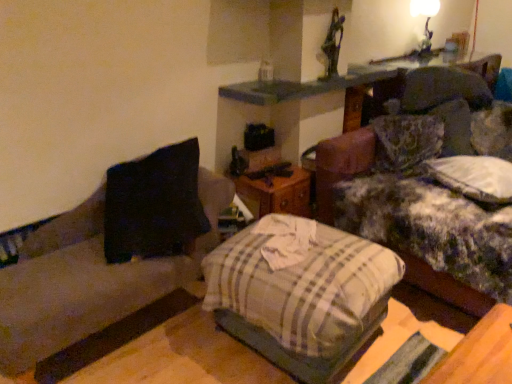
Question: Does black fabric couch at left have a smaller size compared to plaid fabric pillow at center?

Choices:
 (A) no
 (B) yes

Answer: (A)

Question: Can you confirm if black fabric couch at left is wider than plaid fabric pillow at center?

Choices:
 (A) no
 (B) yes

Answer: (A)

Question: Is black fabric couch at left not inside plaid fabric pillow at center?

Choices:
 (A) no
 (B) yes

Answer: (B)

Question: Is the position of black fabric couch at left less distant than that of plaid fabric pillow at center?

Choices:
 (A) yes
 (B) no

Answer: (A)

Question: Does black fabric couch at left have a larger size compared to plaid fabric pillow at center?

Choices:
 (A) yes
 (B) no

Answer: (A)

Question: Is plaid fabric pillow at center to the left or to the right of black fabric couch at left in the image?

Choices:
 (A) right
 (B) left

Answer: (A)

Question: Relative to black fabric couch at left, is plaid fabric pillow at center in front or behind?

Choices:
 (A) behind
 (B) front

Answer: (A)

Question: Looking at the image, does plaid fabric pillow at center seem bigger or smaller compared to black fabric couch at left?

Choices:
 (A) big
 (B) small

Answer: (B)

Question: In terms of height, does plaid fabric pillow at center look taller or shorter compared to black fabric couch at left?

Choices:
 (A) short
 (B) tall

Answer: (A)

Question: Looking at their shapes, would you say fluffy fabric couch at upper right is wider or thinner than plaid fabric pillow at center?

Choices:
 (A) wide
 (B) thin

Answer: (A)

Question: Considering the positions of fluffy fabric couch at upper right and plaid fabric pillow at center in the image, is fluffy fabric couch at upper right taller or shorter than plaid fabric pillow at center?

Choices:
 (A) short
 (B) tall

Answer: (B)

Question: Choose the correct answer: Is fluffy fabric couch at upper right inside plaid fabric pillow at center or outside it?

Choices:
 (A) outside
 (B) inside

Answer: (A)

Question: Considering their positions, is fluffy fabric couch at upper right located in front of or behind plaid fabric pillow at center?

Choices:
 (A) front
 (B) behind

Answer: (B)

Question: Relative to plaid fabric pillow at center, is white glossy lampshade at upper right in front or behind?

Choices:
 (A) front
 (B) behind

Answer: (B)

Question: Considering the relative positions of white glossy lampshade at upper right and plaid fabric pillow at center in the image provided, is white glossy lampshade at upper right to the left or to the right of plaid fabric pillow at center?

Choices:
 (A) left
 (B) right

Answer: (B)